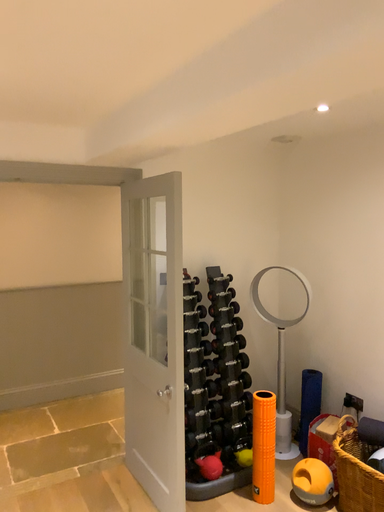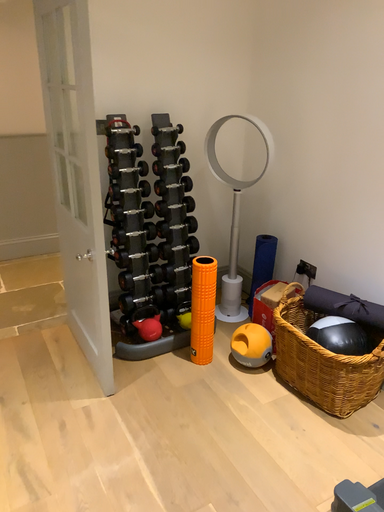
Question: Which way did the camera rotate in the video?

Choices:
 (A) rotated downward
 (B) rotated upward

Answer: (A)